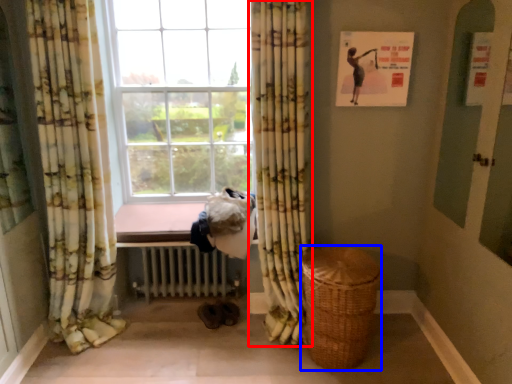
Question: Which object is further to the camera taking this photo, curtain (highlighted by a red box) or basket (highlighted by a blue box)?

Choices:
 (A) curtain
 (B) basket

Answer: (B)